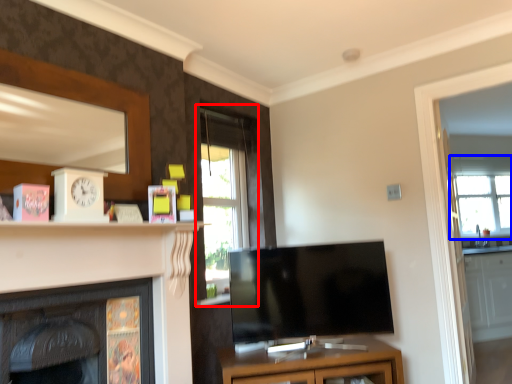
Question: Which of the following is the farthest to the observer, window (highlighted by a red box) or window (highlighted by a blue box)?

Choices:
 (A) window
 (B) window

Answer: (B)